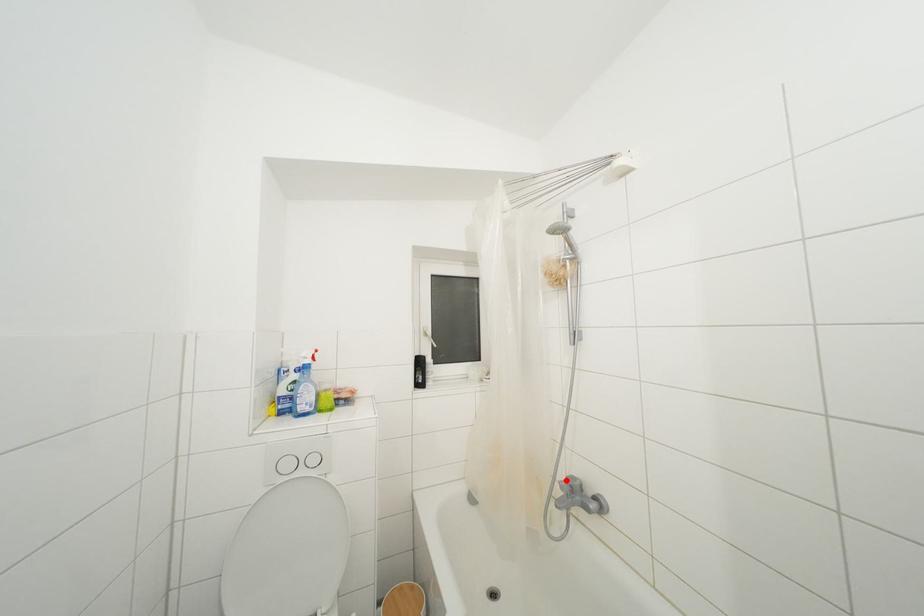
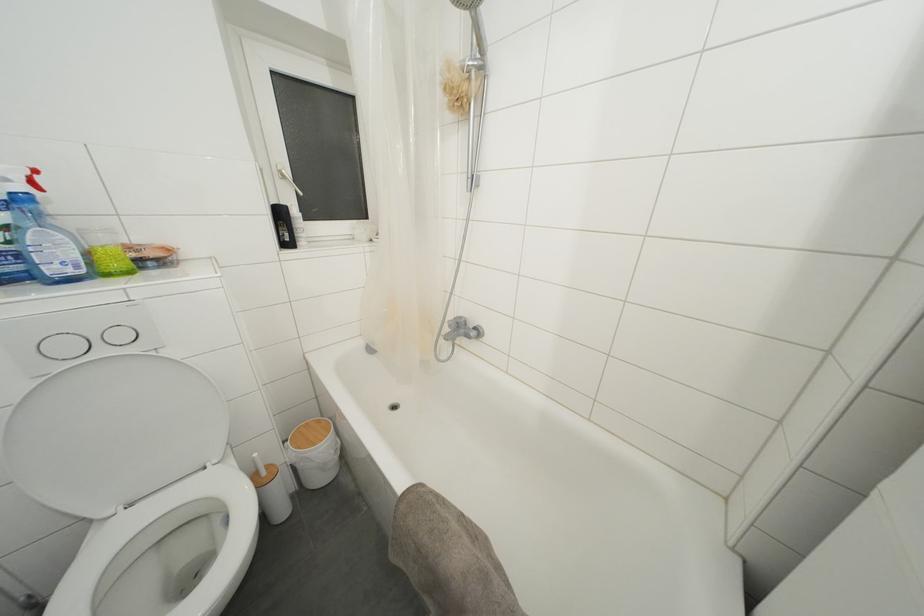
Find the pixel in the second image that matches the highlighted location in the first image.

(455, 321)